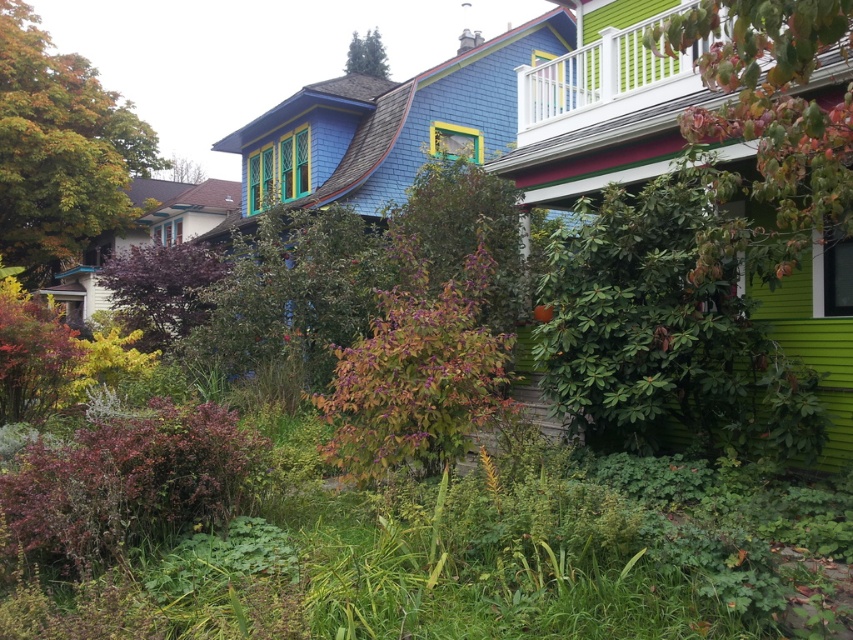
Does green leafy tree at center have a greater height compared to green textured tree at upper center?

No.

Which is below, green leafy tree at center or green textured tree at upper center?

green leafy tree at center

Is point (422, 244) closer to viewer compared to point (350, 49)?

Yes, it is.

In order to click on green leafy tree at center in this screenshot , I will do `click(463, 234)`.

Is green leafy tree at center closer to the viewer compared to green matte bush at lower left?

Yes, it is.

Which of these two, green leafy tree at center or green matte bush at lower left, stands taller?

Standing taller between the two is green matte bush at lower left.

Is point (485, 182) farther from viewer compared to point (47, 305)?

No, (485, 182) is closer to viewer.

Find the location of a particular element. green leafy tree at center is located at coordinates (463, 234).

Consider the image. Which of these two, green leafy bush at right or green textured bush at center, stands taller?

green textured bush at center

Between point (689, 417) and point (291, 305), which one is positioned behind?

Positioned behind is point (291, 305).

Does point (712, 324) come closer to viewer compared to point (274, 272)?

Yes, point (712, 324) is closer to viewer.

Find the location of a particular element. The image size is (853, 640). green leafy bush at right is located at coordinates (672, 323).